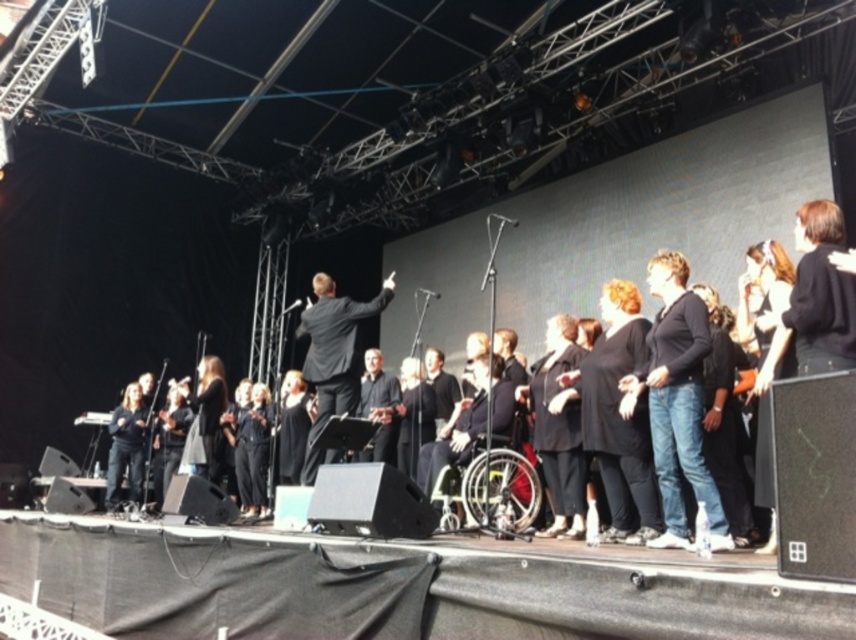
Question: Is the position of black matte suit at center more distant than that of black suit at center?

Choices:
 (A) yes
 (B) no

Answer: (B)

Question: Can you confirm if black matte suit at center is thinner than black suit at center?

Choices:
 (A) no
 (B) yes

Answer: (B)

Question: Is black matte suit at center above black suit at center?

Choices:
 (A) no
 (B) yes

Answer: (B)